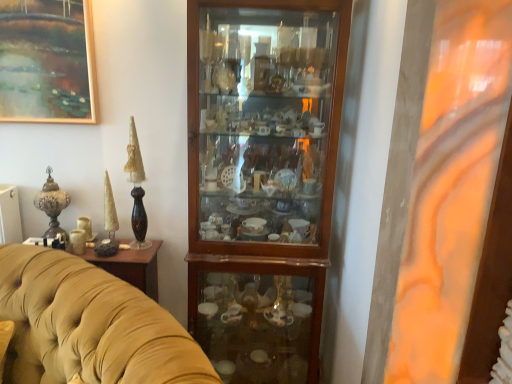
In order to click on polished bronze vase at left in this screenshot , I will do `click(52, 205)`.

Which point is more forward, (39, 206) or (29, 346)?

Positioned in front is point (29, 346).

In the scene shown: Who is more distant, polished bronze vase at left or velvet yellow couch at center?

Positioned behind is polished bronze vase at left.

From a real-world perspective, is polished bronze vase at left above or below velvet yellow couch at center?

polished bronze vase at left is above velvet yellow couch at center.

Based on the photo, is wooden cabinet at center next to velvet yellow couch at center and touching it?

No, wooden cabinet at center is not in contact with velvet yellow couch at center.

Can you confirm if wooden cabinet at center is wider than velvet yellow couch at center?

No, wooden cabinet at center is not wider than velvet yellow couch at center.

From a real-world perspective, does wooden cabinet at center sit lower than velvet yellow couch at center?

No.

Is wooden cabinet at center to the left or to the right of velvet yellow couch at center in the image?

In the image, wooden cabinet at center appears on the right side of velvet yellow couch at center.

Between velvet yellow couch at center and polished bronze vase at left, which one has smaller width?

polished bronze vase at left.

Is velvet yellow couch at center far from polished bronze vase at left?

Actually, velvet yellow couch at center and polished bronze vase at left are a little close together.

Does point (104, 300) lie in front of point (37, 199)?

Yes.

Considering the sizes of objects velvet yellow couch at center and wooden cabinet at center in the image provided, who is shorter, velvet yellow couch at center or wooden cabinet at center?

Standing shorter between the two is velvet yellow couch at center.

Which is more to the left, velvet yellow couch at center or wooden cabinet at center?

velvet yellow couch at center is more to the left.

What's the angular difference between wooden cabinet at center and polished bronze vase at left's facing directions?

0.000361 degrees separate the facing orientations of wooden cabinet at center and polished bronze vase at left.

The height and width of the screenshot is (384, 512). I want to click on cupboard on the right of polished bronze vase at left, so click(x=262, y=180).

Can you confirm if wooden cabinet at center is taller than polished bronze vase at left?

Yes.

Would you consider polished bronze vase at left to be distant from wooden cabinet at center?

Actually, polished bronze vase at left and wooden cabinet at center are a little close together.

What are the coordinates of `candle holder on the left side of wooden cabinet at center` in the screenshot? It's located at (52, 205).

Would you say polished bronze vase at left is inside or outside wooden cabinet at center?

polished bronze vase at left lies outside wooden cabinet at center.

Is polished bronze vase at left at the left side of wooden cabinet at center?

Correct, you'll find polished bronze vase at left to the left of wooden cabinet at center.

The image size is (512, 384). Identify the location of studio couch lying on the right of polished bronze vase at left. (89, 325).

I want to click on cupboard located above the velvet yellow couch at center (from the image's perspective), so click(262, 180).

Which object lies nearer to the anchor point wooden cabinet at center, velvet yellow couch at center or polished bronze vase at left?

velvet yellow couch at center.

Which object lies nearer to the anchor point wooden cabinet at center, polished bronze vase at left or velvet yellow couch at center?

velvet yellow couch at center is closer to wooden cabinet at center.

From the image, which object appears to be nearer to velvet yellow couch at center, wooden cabinet at center or polished bronze vase at left?

polished bronze vase at left is positioned closer to the anchor velvet yellow couch at center.

Considering their positions, is wooden cabinet at center positioned further to polished bronze vase at left than velvet yellow couch at center?

Based on the image, wooden cabinet at center appears to be further to polished bronze vase at left.

Looking at the image, which one is located closer to polished bronze vase at left, velvet yellow couch at center or wooden cabinet at center?

velvet yellow couch at center is closer to polished bronze vase at left.

Estimate the real-world distances between objects in this image. Which object is further from velvet yellow couch at center, polished bronze vase at left or wooden cabinet at center?

Based on the image, wooden cabinet at center appears to be further to velvet yellow couch at center.

Identify the location of studio couch between polished bronze vase at left and wooden cabinet at center. (89, 325).